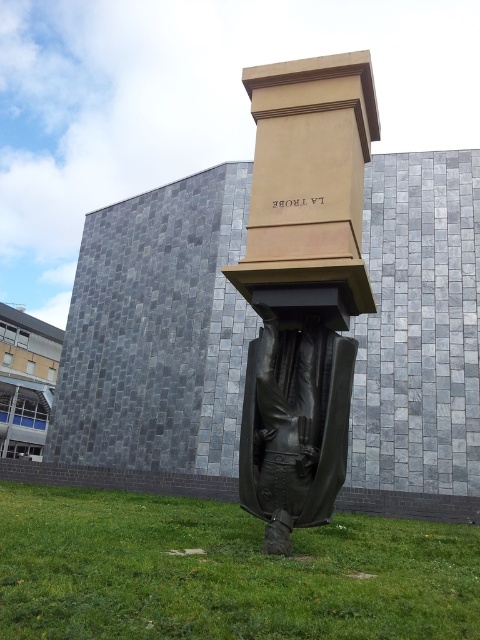
Question: Where is green grass at lower center located in relation to black polished statue at center in the image?

Choices:
 (A) left
 (B) right

Answer: (A)

Question: Which point is farther from the camera taking this photo?

Choices:
 (A) (271, 634)
 (B) (345, 390)

Answer: (B)

Question: Does green grass at lower center appear on the left side of black polished statue at center?

Choices:
 (A) yes
 (B) no

Answer: (A)

Question: Is green grass at lower center thinner than black polished statue at center?

Choices:
 (A) yes
 (B) no

Answer: (B)